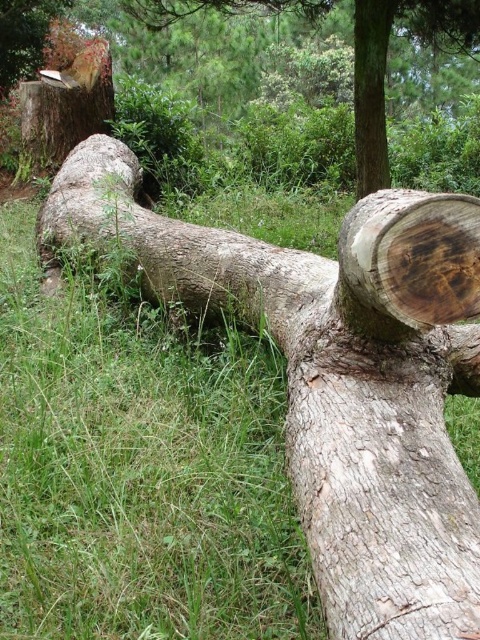
You are a gardener trying to plant flowers between the green grass at center and the smooth brown log at center. Based on their widths, which area would allow for more flowers to be planted?

The green grass at center has a larger width than the smooth brown log at center, so planting more flowers would be possible in the green grass at center area.

You are standing at the edge of a forest and see the green grass at center and the smooth brown log at center. Which object is positioned to the left when viewed from your perspective?

The green grass at center is positioned to the left of the smooth brown log at center.